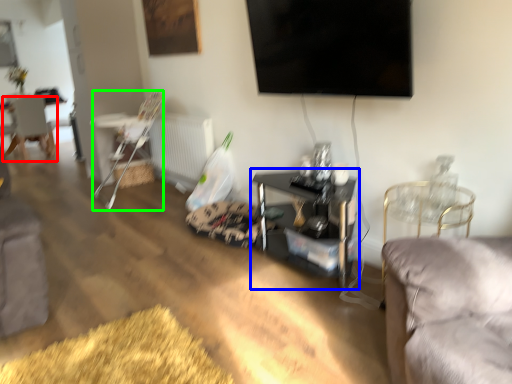
Question: Which object is the farthest from chair (highlighted by a red box)? Choose among these: table (highlighted by a blue box) or chair (highlighted by a green box).

Choices:
 (A) table
 (B) chair

Answer: (A)